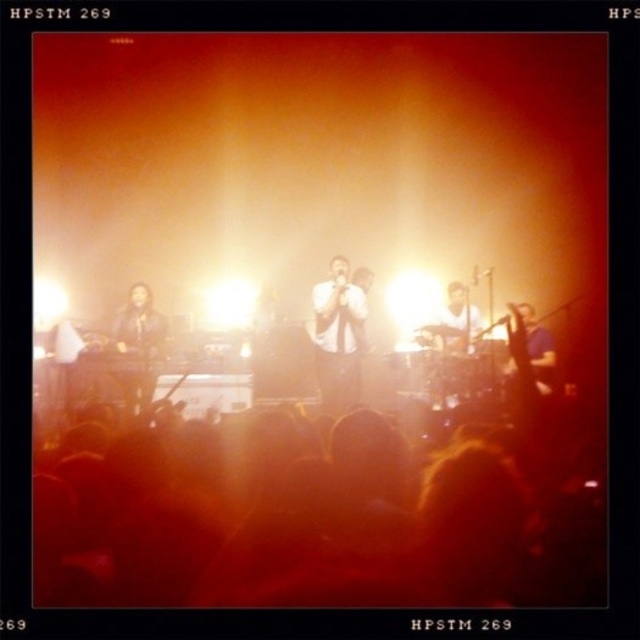
You are a photographer at the concert venue. You want to capture a closeup of the white matte shirt at center. The camera is currently focused at point (454,321). Is this point on the white matte shirt at center?

Yes, the point (454,321) is on the white matte shirt at center, so the camera is focused on the correct area.

You are a photographer at the concert venue. You want to capture a photo that highlights both the silhouette crowd at lower center and the white glossy shirt at center. Given their size difference, which object would appear more prominent in the final image?

The silhouette crowd at lower center would appear more prominent in the final image because it is larger in size than the white glossy shirt at center.

You are a photographer at the concert venue and want to capture a photo of the white glossy shirt at center without the silhouette crowd at lower center blocking it. What should you adjust in your camera settings to achieve this?

To capture the white glossy shirt at center without the silhouette crowd at lower center blocking it, you should adjust the focus to focus on the white glossy shirt at center and use a smaller aperture to increase the depth of field, ensuring the silhouette crowd at lower center is blurred and out of focus.